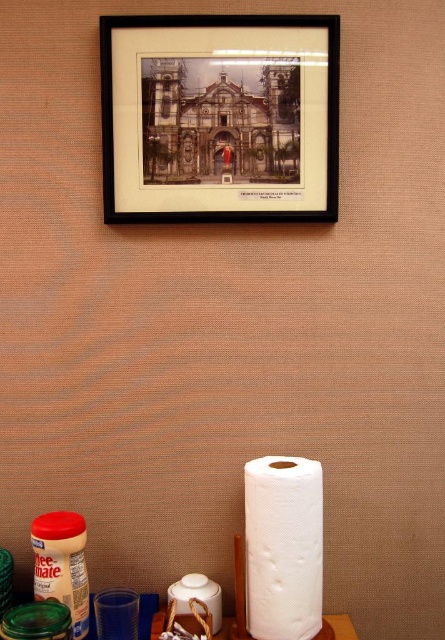
Question: Does black matte picture frame at upper center appear on the left side of white matte toilet paper at lower center?

Choices:
 (A) no
 (B) yes

Answer: (B)

Question: Does black matte picture frame at upper center lie in front of white matte toilet paper at lower center?

Choices:
 (A) no
 (B) yes

Answer: (A)

Question: Among these objects, which one is nearest to the camera?

Choices:
 (A) black matte picture frame at upper center
 (B) white matte toilet paper at lower center

Answer: (B)

Question: Does black matte picture frame at upper center have a lesser width compared to white matte toilet paper at lower center?

Choices:
 (A) no
 (B) yes

Answer: (A)

Question: Which point is closer to the camera?

Choices:
 (A) black matte picture frame at upper center
 (B) white matte toilet paper at lower center

Answer: (B)